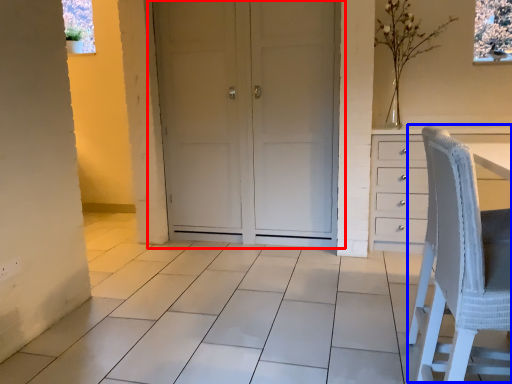
Question: Among these objects, which one is farthest to the camera, door (highlighted by a red box) or rocking chair (highlighted by a blue box)?

Choices:
 (A) door
 (B) rocking chair

Answer: (A)